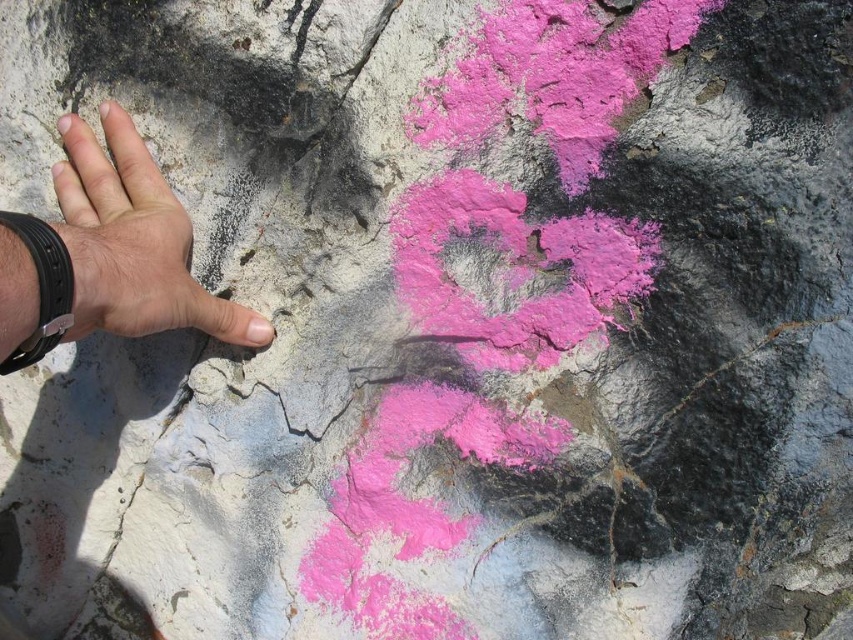
Question: Which object is closer to the camera taking this photo?

Choices:
 (A) skinny white hand at left
 (B) cracked stone at center

Answer: (A)

Question: Can you confirm if skinny white hand at left is bigger than cracked stone at center?

Choices:
 (A) yes
 (B) no

Answer: (A)

Question: Does skinny white hand at left appear under cracked stone at center?

Choices:
 (A) no
 (B) yes

Answer: (A)

Question: Is skinny white hand at left above cracked stone at center?

Choices:
 (A) yes
 (B) no

Answer: (A)